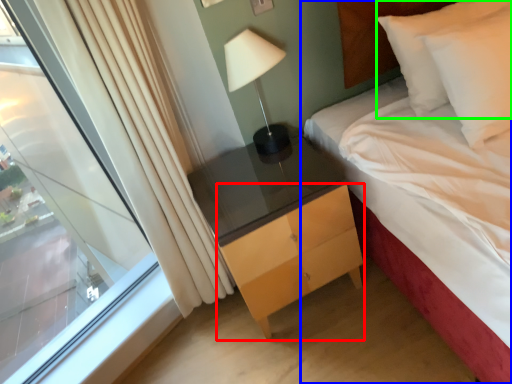
Question: Estimate the real-world distances between objects in this image. Which object is closer to chest of drawers (highlighted by a red box), bed (highlighted by a blue box) or pillow (highlighted by a green box)?

Choices:
 (A) bed
 (B) pillow

Answer: (A)